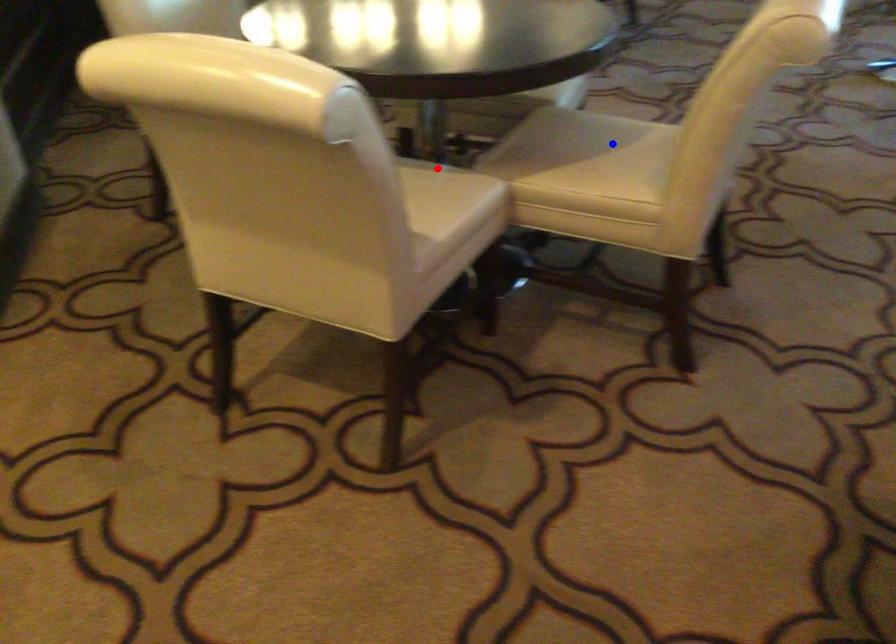
Question: Two points are marked on the image. Which point is closer to the camera?

Choices:
 (A) Blue point is closer.
 (B) Red point is closer.

Answer: (B)